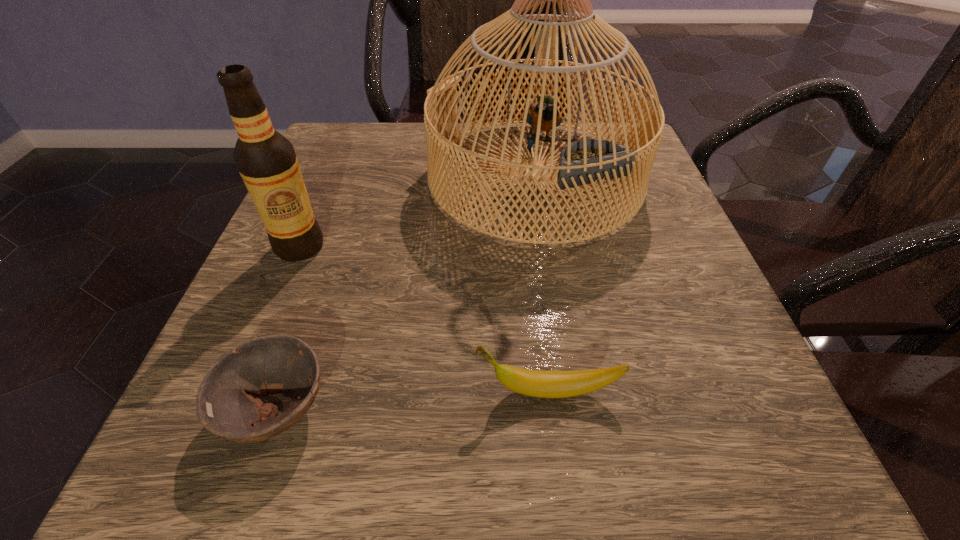
At what (x,y) coordinates should I click in order to perform the action: click on free space at the right edge. Please return your answer as a coordinate pair (x, y). The image size is (960, 540). Looking at the image, I should click on (675, 325).

Find the location of `free space at the far left corner`. free space at the far left corner is located at coordinates (366, 139).

Identify the location of free space that is in between the birdcage and the alcohol. (418, 212).

Find the location of `blank region between the third shortest object and the birdcage`. blank region between the third shortest object and the birdcage is located at coordinates (418, 212).

What are the coordinates of `blank region between the banana and the tallest object` in the screenshot? It's located at 541,284.

Find the location of a particular element. free point between the third tallest object and the shortest object is located at coordinates (413, 400).

Image resolution: width=960 pixels, height=540 pixels. Identify the location of unoccupied area between the banana and the birdcage. (541, 284).

Where is `blank region between the alcohol and the second shortest object`? This screenshot has width=960, height=540. blank region between the alcohol and the second shortest object is located at coordinates (424, 319).

This screenshot has width=960, height=540. Identify the location of blank region between the tallest object and the bowl. (406, 293).

This screenshot has width=960, height=540. What are the coordinates of `free space between the alcohol and the shortest object` in the screenshot? It's located at (289, 328).